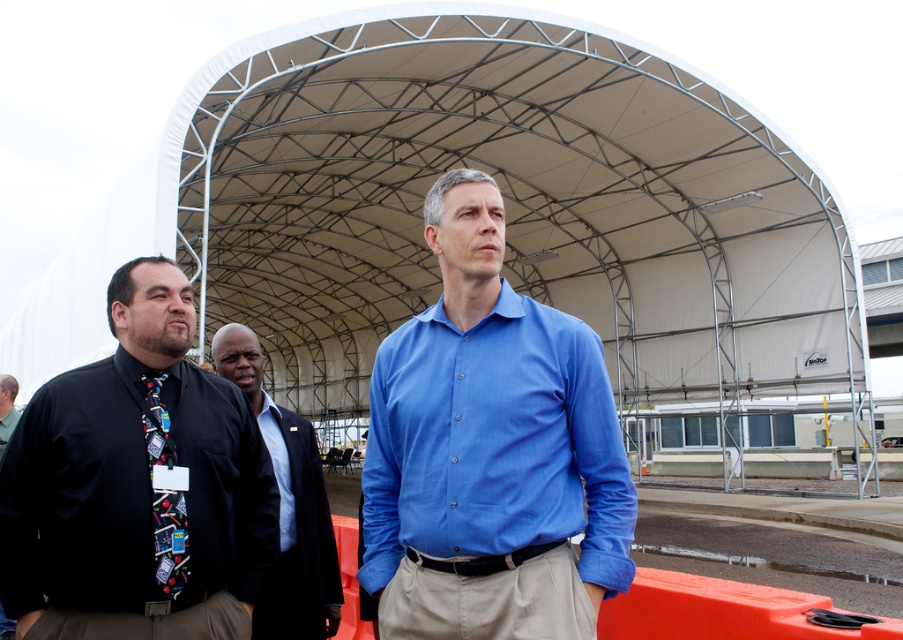
You are a photographer at the event and need to capture a photo of the two men at center. The dark blue suit at center and the light blue cotton shirt at center. According to the scene description, which one is positioned to the right?

The dark blue suit at center is positioned to the right of the light blue cotton shirt at center according to the objects description.

You are a photographer standing behind the three men. You want to take a photo that includes both the blue cotton shirt at center and the black tie at left. Which one will appear larger in the photo?

The blue cotton shirt at center will appear larger in the photo because it is closer to the viewer than the black tie at left.